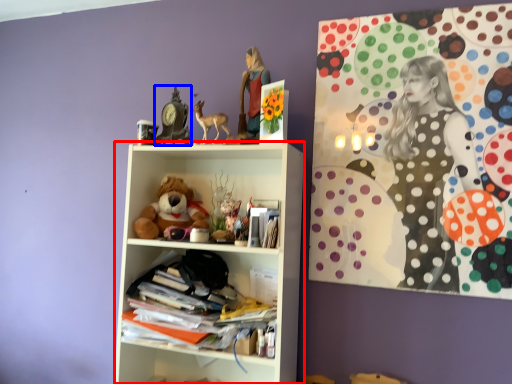
Question: Among these objects, which one is farthest to the camera, shelf (highlighted by a red box) or art (highlighted by a blue box)?

Choices:
 (A) shelf
 (B) art

Answer: (B)